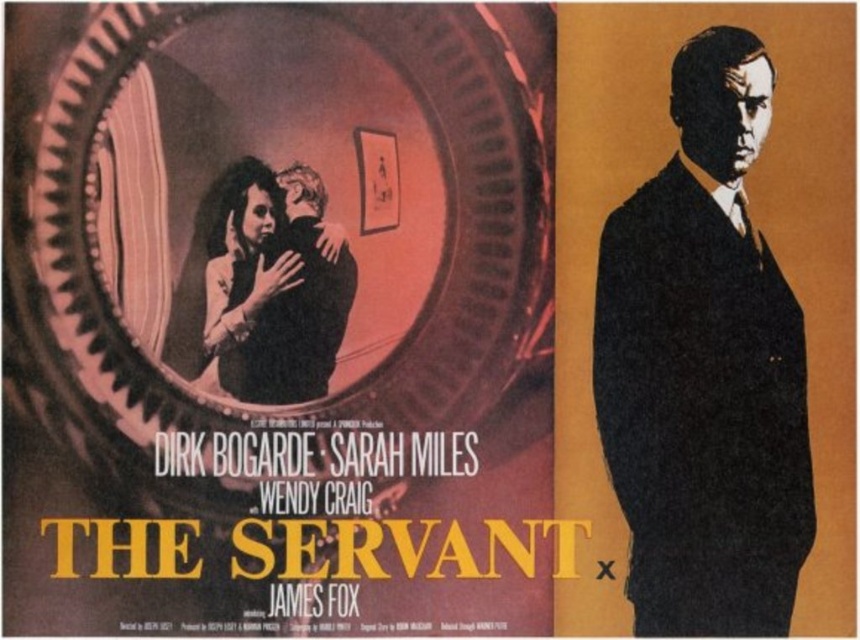
Does matte black suit at right appear on the left side of smooth black suit at center?

Incorrect, matte black suit at right is not on the left side of smooth black suit at center.

Who is positioned more to the right, matte black suit at right or smooth black suit at center?

Positioned to the right is matte black suit at right.

Locate an element on the screen. matte black suit at right is located at coordinates (704, 368).

Who is taller, matte black suit at right or black paper at center?

Standing taller between the two is matte black suit at right.

Is matte black suit at right wider than black paper at center?

Indeed, matte black suit at right has a greater width compared to black paper at center.

The height and width of the screenshot is (640, 860). I want to click on matte black suit at right, so click(x=704, y=368).

Locate an element on the screen. matte black suit at right is located at coordinates (704, 368).

Which of these two, smooth black suit at center or black paper at center, stands shorter?

With less height is black paper at center.

The image size is (860, 640). Identify the location of smooth black suit at center. (275, 285).